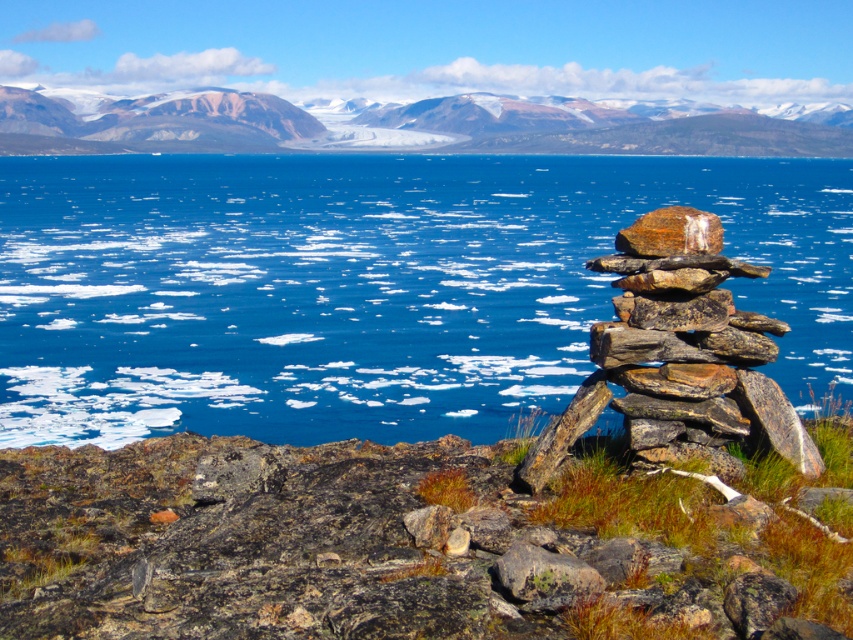
You are a hiker trying to navigate using the landmarks in the image. You see the rugged granite mountain at upper center and the rusty metallic rock at lower center. Which of these landmarks is located to the left of the other?

The rugged granite mountain at upper center is positioned on the left side of the rusty metallic rock at lower center.

You are a hiker who just arrived at the scene. You see the rusty rock at lower right and the rugged granite mountain at upper center. Which object is positioned higher in the image?

The rugged granite mountain at upper center is positioned higher in the image than the rusty rock at lower right.

You are standing at the base of the mountains in the image and want to reach the point marked at coordinates (x=36, y=92). Given that you can walk at a steady pace of 3 meters per minute, how many minutes will it take you to reach that point?

The point marked at coordinates (x=36, y=92) is 255.58 meters away from the viewer. At a pace of 3 meters per minute, it would take approximately 85.19 minutes to reach the point.